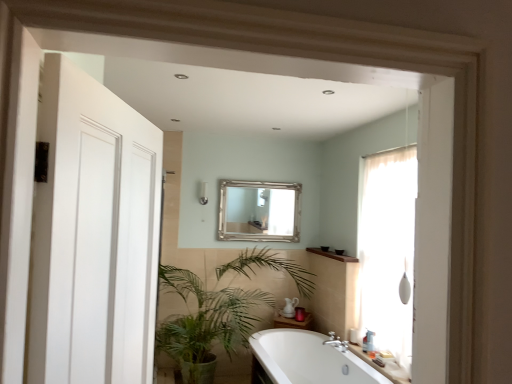
Find the location of a particular element. This screenshot has height=384, width=512. white matte door at left is located at coordinates (93, 235).

What do you see at coordinates (388, 250) in the screenshot? Image resolution: width=512 pixels, height=384 pixels. I see `translucent fabric curtain at right` at bounding box center [388, 250].

Describe the element at coordinates (376, 365) in the screenshot. I see `white glossy counter top at lower right` at that location.

Describe the element at coordinates (370, 340) in the screenshot. I see `white plastic bottle at lower right` at that location.

Image resolution: width=512 pixels, height=384 pixels. Find the location of `white matte door at left`. white matte door at left is located at coordinates (93, 235).

From the image's perspective, which one is positioned lower, white glossy counter top at lower right or green leafy plant at lower left?

white glossy counter top at lower right is shown below in the image.

The image size is (512, 384). Identify the location of counter top on the right of green leafy plant at lower left. (376, 365).

Considering the sizes of objects white glossy counter top at lower right and green leafy plant at lower left in the image provided, who is wider, white glossy counter top at lower right or green leafy plant at lower left?

green leafy plant at lower left is wider.

From a real-world perspective, is silver metallic mirror at upper center physically below white glossy bathtub at center?

No, from a real-world perspective, silver metallic mirror at upper center is not below white glossy bathtub at center.

Considering the positions of points (277, 199) and (329, 378), is point (277, 199) closer to camera compared to point (329, 378)?

No, (277, 199) is behind (329, 378).

Considering the relative sizes of silver metallic mirror at upper center and white glossy bathtub at center in the image provided, is silver metallic mirror at upper center taller than white glossy bathtub at center?

Indeed, silver metallic mirror at upper center has a greater height compared to white glossy bathtub at center.

Is there a large distance between silver metallic mirror at upper center and white glossy bathtub at center?

Yes, silver metallic mirror at upper center and white glossy bathtub at center are located far from each other.

Can you confirm if silver metallic mirror at upper center is positioned to the right of green leafy plant at lower left?

Indeed, silver metallic mirror at upper center is positioned on the right side of green leafy plant at lower left.

Is silver metallic mirror at upper center positioned far away from green leafy plant at lower left?

No, silver metallic mirror at upper center is in close proximity to green leafy plant at lower left.

From a real-world perspective, is silver metallic mirror at upper center above or below green leafy plant at lower left?

In terms of real-world spatial position, silver metallic mirror at upper center is above green leafy plant at lower left.

Which of these two, silver metallic mirror at upper center or green leafy plant at lower left, is thinner?

silver metallic mirror at upper center.

Considering the positions of objects white glossy counter top at lower right and white matte door at left in the image provided, who is in front, white glossy counter top at lower right or white matte door at left?

white matte door at left is closer to the camera.

Is white glossy counter top at lower right situated inside white matte door at left or outside?

white glossy counter top at lower right is outside white matte door at left.

Based on the photo, how much distance is there between white glossy counter top at lower right and white matte door at left?

white glossy counter top at lower right is 7.79 feet from white matte door at left.

Consider the image. Which of these two, white glossy counter top at lower right or white matte door at left, stands shorter?

white glossy counter top at lower right.

Which is less distant, (370, 342) or (341, 369)?

Point (370, 342) appears to be closer to the viewer than point (341, 369).

Considering the positions of objects white plastic bottle at lower right and white glossy bathtub at center in the image provided, who is more to the right, white plastic bottle at lower right or white glossy bathtub at center?

white plastic bottle at lower right is more to the right.

From a real-world perspective, relative to white glossy bathtub at center, is white plastic bottle at lower right vertically above or below?

Clearly, from a real-world perspective, white plastic bottle at lower right is above white glossy bathtub at center.

How many degrees apart are the facing directions of white plastic bottle at lower right and white matte door at left?

They differ by 163 degrees in their facing directions.

How distant is white plastic bottle at lower right from white matte door at left?

white plastic bottle at lower right is 8.93 feet from white matte door at left.

Is white plastic bottle at lower right taller or shorter than white matte door at left?

In the image, white plastic bottle at lower right appears to be shorter than white matte door at left.

In the image, is white plastic bottle at lower right on the left side or the right side of white matte door at left?

white plastic bottle at lower right is to the right of white matte door at left.

From a real-world perspective, between white plastic bottle at lower right and translucent fabric curtain at right, who is vertically lower?

white plastic bottle at lower right, from a real-world perspective.

Is white plastic bottle at lower right next to translucent fabric curtain at right?

white plastic bottle at lower right is not next to translucent fabric curtain at right, and they're not touching.

Considering the relative positions of white plastic bottle at lower right and translucent fabric curtain at right in the image provided, is white plastic bottle at lower right in front of translucent fabric curtain at right?

No, the depth of white plastic bottle at lower right is greater than that of translucent fabric curtain at right.

This screenshot has width=512, height=384. What are the coordinates of `houseplant that appears above the white glossy counter top at lower right (from the image's perspective)` in the screenshot? It's located at (219, 308).

The image size is (512, 384). Find the location of `mirror that appears on the left of white glossy bathtub at center`. mirror that appears on the left of white glossy bathtub at center is located at coordinates (260, 211).

Looking at the image, which one is located closer to green leafy plant at lower left, white matte door at left or white glossy counter top at lower right?

Based on the image, white glossy counter top at lower right appears to be nearer to green leafy plant at lower left.

From the image, which object appears to be nearer to silver metallic mirror at upper center, white matte door at left or white plastic bottle at lower right?

white plastic bottle at lower right is positioned closer to the anchor silver metallic mirror at upper center.

When comparing their distances from green leafy plant at lower left, does silver metallic mirror at upper center or white matte door at left seem further?

white matte door at left lies further to green leafy plant at lower left than the other object.

From the image, which object appears to be farther from white glossy counter top at lower right, silver metallic mirror at upper center or white glossy bathtub at center?

silver metallic mirror at upper center is positioned further to the anchor white glossy counter top at lower right.

Based on the photo, looking at the image, which one is located closer to white glossy bathtub at center, translucent fabric curtain at right or white matte door at left?

translucent fabric curtain at right is positioned closer to the anchor white glossy bathtub at center.

From the image, which object appears to be farther from green leafy plant at lower left, translucent fabric curtain at right or silver metallic mirror at upper center?

translucent fabric curtain at right lies further to green leafy plant at lower left than the other object.

Looking at the image, which one is located closer to white glossy bathtub at center, white matte door at left or white plastic bottle at lower right?

white plastic bottle at lower right is positioned closer to the anchor white glossy bathtub at center.

Estimate the real-world distances between objects in this image. Which object is closer to white glossy bathtub at center, translucent fabric curtain at right or silver metallic mirror at upper center?

The object closer to white glossy bathtub at center is translucent fabric curtain at right.

Where is `toiletry situated between green leafy plant at lower left and translucent fabric curtain at right from left to right`? This screenshot has height=384, width=512. toiletry situated between green leafy plant at lower left and translucent fabric curtain at right from left to right is located at coordinates (370, 340).

This screenshot has height=384, width=512. Find the location of `bathtub between white matte door at left and translucent fabric curtain at right from front to back`. bathtub between white matte door at left and translucent fabric curtain at right from front to back is located at coordinates (309, 359).

Where is `houseplant positioned between white glossy counter top at lower right and silver metallic mirror at upper center from near to far`? This screenshot has width=512, height=384. houseplant positioned between white glossy counter top at lower right and silver metallic mirror at upper center from near to far is located at coordinates (219, 308).

Identify the location of counter top between translucent fabric curtain at right and silver metallic mirror at upper center in the front-back direction. This screenshot has height=384, width=512. (376, 365).